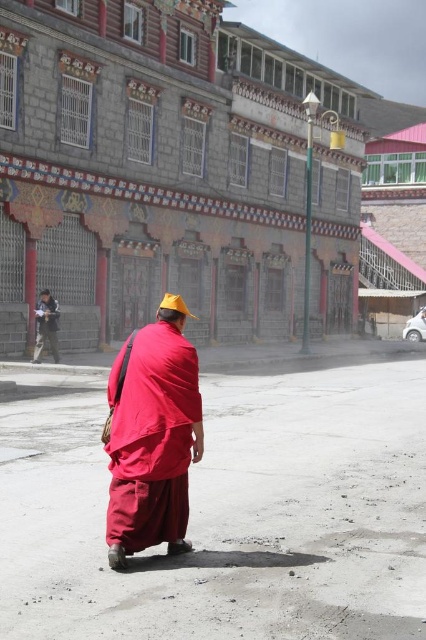
This screenshot has height=640, width=426. In order to click on red cotton robe at center in this screenshot , I will do `click(152, 440)`.

Which is in front, point (150, 532) or point (54, 314)?

Point (150, 532) is in front.

Image resolution: width=426 pixels, height=640 pixels. Find the location of `red cotton robe at center`. red cotton robe at center is located at coordinates (152, 440).

Who is positioned more to the left, gray stone building at center or matte black monk at left?

From the viewer's perspective, matte black monk at left appears more on the left side.

How much distance is there between gray stone building at center and matte black monk at left?

A distance of 30.07 feet exists between gray stone building at center and matte black monk at left.

Is point (163, 106) more distant than point (54, 332)?

Yes.

Where is `gray stone building at center`? gray stone building at center is located at coordinates (169, 172).

Between point (166, 413) and point (175, 300), which one is positioned in front?

Point (166, 413) is more forward.

Can you confirm if red cotton robe at center is positioned to the left of yellow fabric hat at center?

Incorrect, red cotton robe at center is not on the left side of yellow fabric hat at center.

Which is behind, point (131, 529) or point (173, 307)?

Positioned behind is point (173, 307).

Find the location of `red cotton robe at center`. red cotton robe at center is located at coordinates (152, 440).